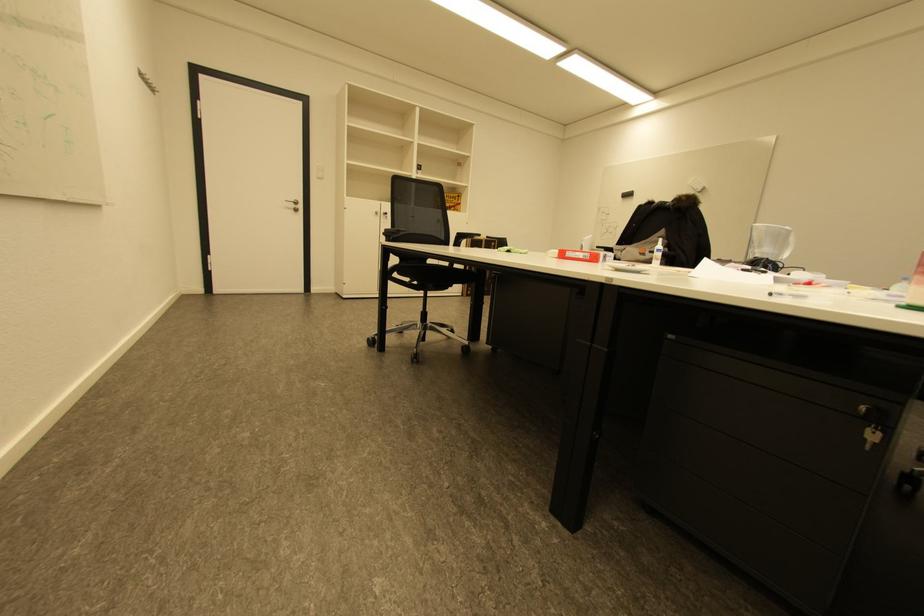
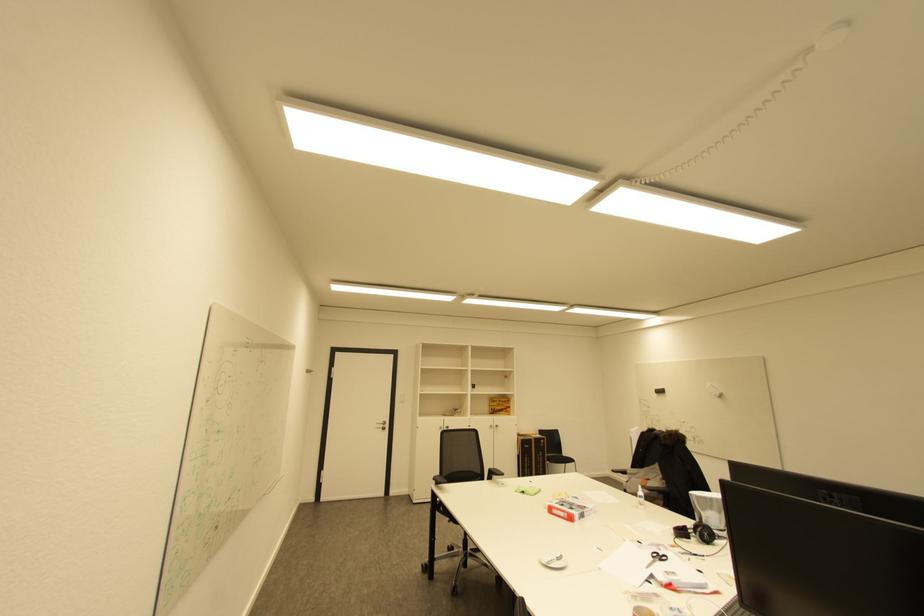
Locate, in the second image, the point that corresponds to pixel 492 240 in the first image.

(541, 439)